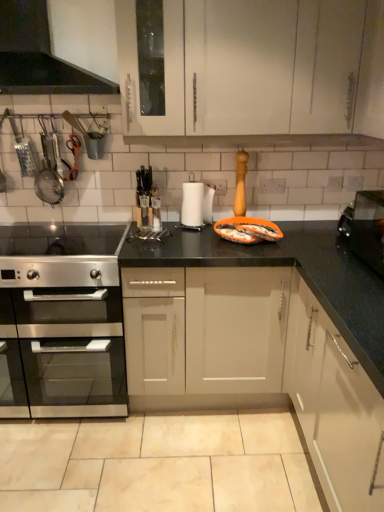
Find the location of a particular element. The width and height of the screenshot is (384, 512). vacant area that is in front of matte white cabinet at center is located at coordinates (229, 465).